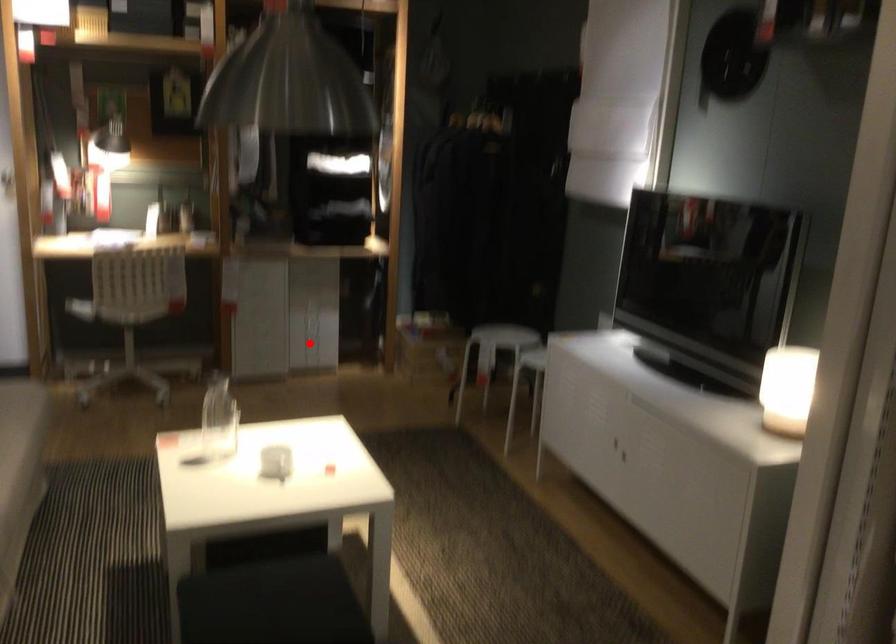
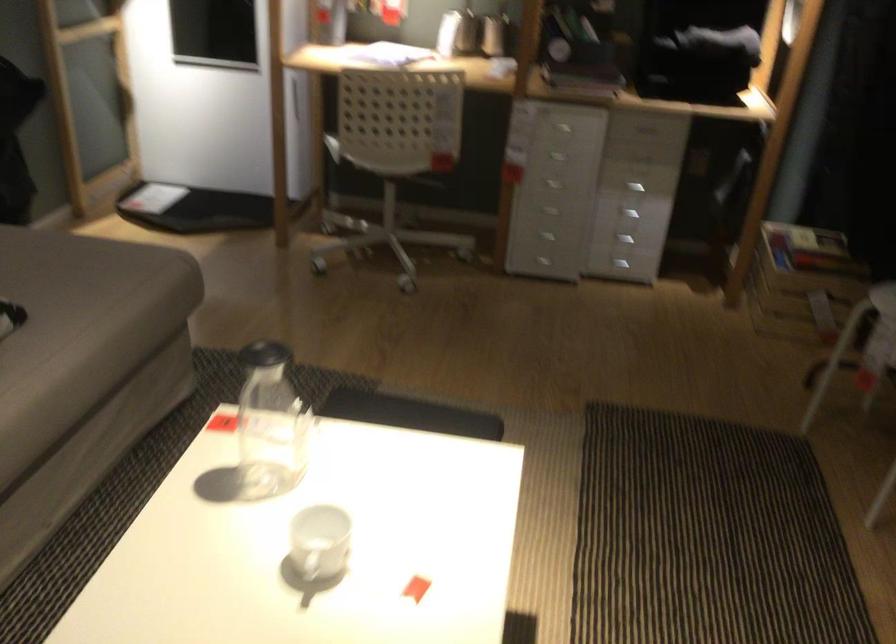
Question: I am providing you with two images of the same scene from different viewpoints. Image1 has a red point marked. In image2, the corresponding 3D location appears at what relative position? Reply with the corresponding letter.

Choices:
 (A) Closer
 (B) Farther

Answer: (A)